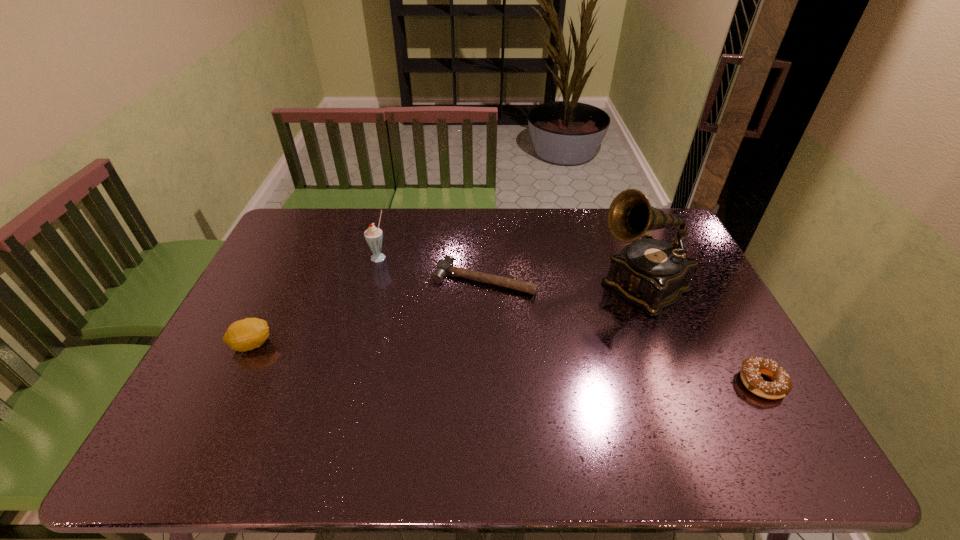
Image resolution: width=960 pixels, height=540 pixels. Find the location of `free region located 0.190m on the back of the nearest object`. free region located 0.190m on the back of the nearest object is located at coordinates (722, 313).

Locate an element on the screen. free space located 0.200m on the straw side of the second object from left to right is located at coordinates (415, 295).

At what (x,y) coordinates should I click in order to perform the action: click on free region located 0.060m on the straw side of the second object from left to right. Please return your answer as a coordinate pair (x, y). This screenshot has width=960, height=540. Looking at the image, I should click on (392, 271).

At what (x,y) coordinates should I click in order to perform the action: click on blank space located 0.190m on the straw side of the second object from left to right. Please return your answer as a coordinate pair (x, y). The height and width of the screenshot is (540, 960). Looking at the image, I should click on (413, 293).

Where is `vacant space located on the horn of the tallest object`? This screenshot has height=540, width=960. vacant space located on the horn of the tallest object is located at coordinates (539, 355).

Where is `vacant space located on the horn of the tallest object`? vacant space located on the horn of the tallest object is located at coordinates (559, 341).

Identify the location of free space located on the horn of the tallest object. (551, 347).

Where is `vacant space located on the striking face of the third object from right to left`? The image size is (960, 540). vacant space located on the striking face of the third object from right to left is located at coordinates (454, 320).

You are a GUI agent. You are given a task and a screenshot of the screen. Output one action in this format:
    pyautogui.click(x=<x>, y=<y>)
    Task: Click on the vacant space situated on the striking face of the third object from right to left
    This screenshot has height=540, width=960.
    Given the screenshot: What is the action you would take?
    click(437, 351)

Where is `vacant region located 0.090m on the striking face of the third object from right to left`? Image resolution: width=960 pixels, height=540 pixels. vacant region located 0.090m on the striking face of the third object from right to left is located at coordinates (455, 318).